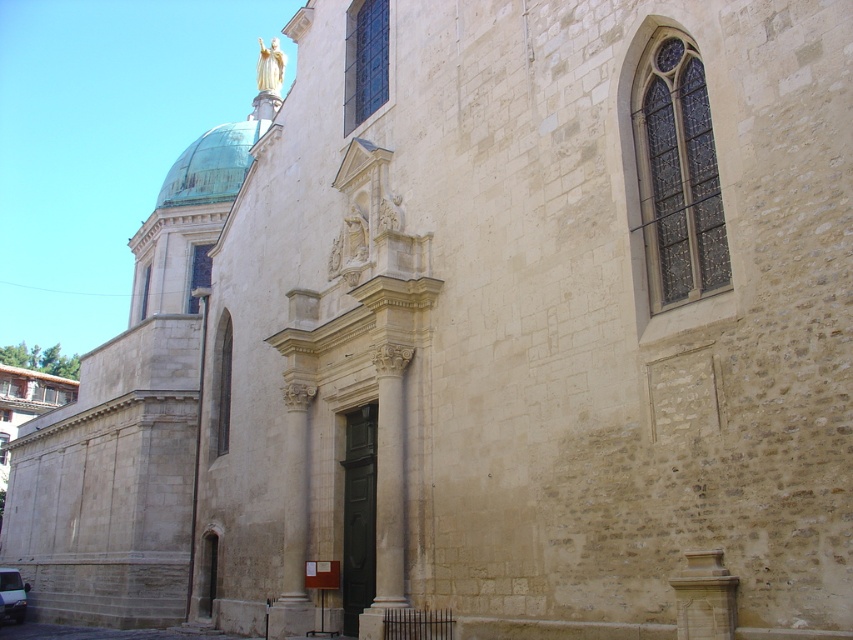
Question: Among these points, which one is farthest from the camera?

Choices:
 (A) (190, 163)
 (B) (9, 612)

Answer: (A)

Question: Does green copper dome at upper left have a greater width compared to white glossy van at lower left?

Choices:
 (A) no
 (B) yes

Answer: (B)

Question: Does green copper dome at upper left have a lesser width compared to white glossy van at lower left?

Choices:
 (A) no
 (B) yes

Answer: (A)

Question: Which point is closer to the camera taking this photo?

Choices:
 (A) (4, 572)
 (B) (198, 138)

Answer: (A)

Question: Is green copper dome at upper left above white glossy van at lower left?

Choices:
 (A) no
 (B) yes

Answer: (B)

Question: Which point is closer to the camera taking this photo?

Choices:
 (A) (241, 140)
 (B) (15, 604)

Answer: (B)